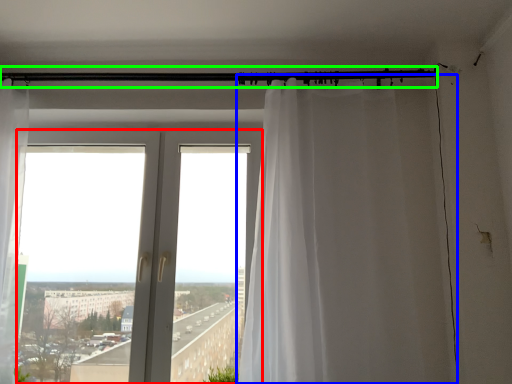
Question: Which is nearer to the window (highlighted by a red box)? curtain (highlighted by a blue box) or beam (highlighted by a green box).

Choices:
 (A) curtain
 (B) beam

Answer: (A)